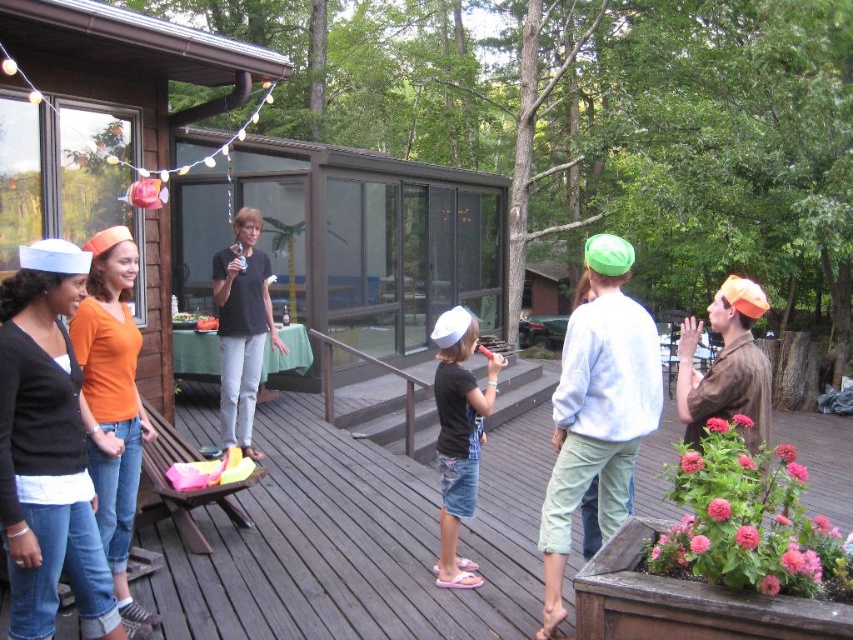
Which is below, matte black cardigan at left or black cotton shirt at center?

matte black cardigan at left

Consider the image. Does matte black cardigan at left appear on the right side of black cotton shirt at center?

Yes, matte black cardigan at left is to the right of black cotton shirt at center.

Which is behind, point (74, 268) or point (235, 298)?

Positioned behind is point (235, 298).

Where is `matte black cardigan at left`? This screenshot has width=853, height=640. matte black cardigan at left is located at coordinates click(47, 451).

Which is above, wooden deck at center or black cotton shirt at center?

Positioned higher is black cotton shirt at center.

Who is more forward, [529,522] or [216,260]?

Point [529,522] is more forward.

This screenshot has width=853, height=640. I want to click on wooden deck at center, so click(357, 541).

Is point (445, 467) closer to viewer compared to point (729, 275)?

Yes, point (445, 467) is in front of point (729, 275).

Locate an element on the screen. matte black shirt at center is located at coordinates (457, 436).